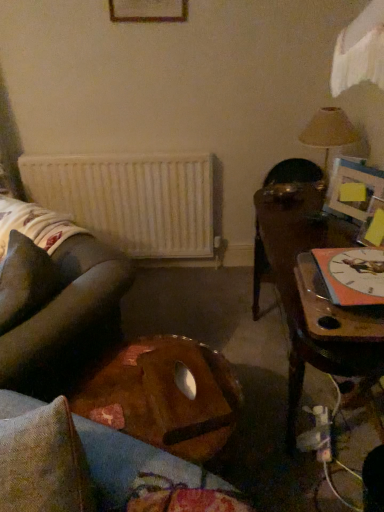
Question: Is wooden table at right, the first table in the right-to-left sequence, positioned behind matte beige lampshade at upper right?

Choices:
 (A) no
 (B) yes

Answer: (A)

Question: Is the position of wooden table at right, the 2th table viewed from the left, less distant than that of matte beige lampshade at upper right?

Choices:
 (A) no
 (B) yes

Answer: (B)

Question: From a real-world perspective, does wooden table at right, the first table in the right-to-left sequence, stand above matte beige lampshade at upper right?

Choices:
 (A) yes
 (B) no

Answer: (B)

Question: Is wooden table at right, the first table in the right-to-left sequence, directly adjacent to matte beige lampshade at upper right?

Choices:
 (A) yes
 (B) no

Answer: (B)

Question: Is wooden table at right, the 2th table viewed from the left, oriented towards matte beige lampshade at upper right?

Choices:
 (A) no
 (B) yes

Answer: (A)

Question: Is wooden table at right, the 2th table viewed from the left, thinner than matte beige lampshade at upper right?

Choices:
 (A) yes
 (B) no

Answer: (B)

Question: From the image's perspective, would you say wooden table at right, the first table in the right-to-left sequence, is shown under wooden tray at center, arranged as the 1th table when viewed from the left?

Choices:
 (A) no
 (B) yes

Answer: (A)

Question: Is wooden table at right, the first table in the right-to-left sequence, positioned in front of wooden tray at center, the second table viewed from the right?

Choices:
 (A) no
 (B) yes

Answer: (B)

Question: Is wooden table at right, the first table in the right-to-left sequence, smaller than wooden tray at center, arranged as the 1th table when viewed from the left?

Choices:
 (A) yes
 (B) no

Answer: (B)

Question: Is wooden table at right, the first table in the right-to-left sequence, shorter than wooden tray at center, the second table viewed from the right?

Choices:
 (A) no
 (B) yes

Answer: (A)

Question: Does wooden table at right, the first table in the right-to-left sequence, lie behind wooden tray at center, the second table viewed from the right?

Choices:
 (A) yes
 (B) no

Answer: (B)

Question: Is wooden table at right, the first table in the right-to-left sequence, oriented towards wooden tray at center, the second table viewed from the right?

Choices:
 (A) yes
 (B) no

Answer: (A)

Question: Is wooden table at right, the 2th table viewed from the left, touching white matte radiator at center?

Choices:
 (A) yes
 (B) no

Answer: (B)